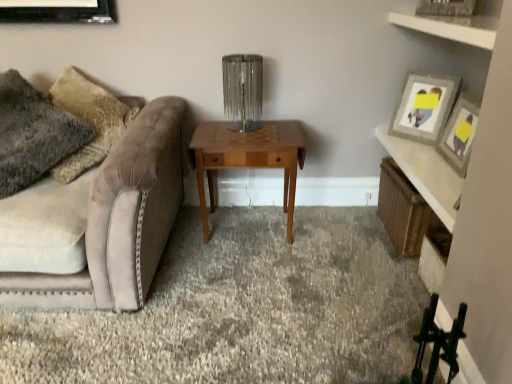
Question: Can you confirm if fuzzy fabric pillow at left is shorter than wooden picture frame at upper right?

Choices:
 (A) yes
 (B) no

Answer: (B)

Question: From a real-world perspective, does fuzzy fabric pillow at left stand above wooden picture frame at upper right?

Choices:
 (A) no
 (B) yes

Answer: (A)

Question: Is fuzzy fabric pillow at left wider than wooden picture frame at upper right?

Choices:
 (A) yes
 (B) no

Answer: (A)

Question: Can you confirm if fuzzy fabric pillow at left is positioned to the right of wooden picture frame at upper right?

Choices:
 (A) yes
 (B) no

Answer: (B)

Question: Is fuzzy fabric pillow at left at the left side of wooden picture frame at upper right?

Choices:
 (A) no
 (B) yes

Answer: (B)

Question: Looking at their shapes, would you say wooden picture frame at upper right is wider or thinner than woven wicker basket at right, marked as the first shelf in a bottom-to-top arrangement?

Choices:
 (A) thin
 (B) wide

Answer: (A)

Question: Is wooden picture frame at upper right taller or shorter than woven wicker basket at right, placed as the 2th shelf when sorted from top to bottom?

Choices:
 (A) tall
 (B) short

Answer: (A)

Question: Would you say wooden picture frame at upper right is to the left or to the right of woven wicker basket at right, the first shelf positioned from the back, in the picture?

Choices:
 (A) right
 (B) left

Answer: (A)

Question: Does point (445, 102) appear closer or farther from the camera than point (411, 226)?

Choices:
 (A) farther
 (B) closer

Answer: (A)

Question: Considering the relative positions of clear glass table lamp at center and white wood shelf at upper right, arranged as the 2th shelf when viewed from the back, in the image provided, is clear glass table lamp at center to the left or to the right of white wood shelf at upper right, arranged as the 2th shelf when viewed from the back,?

Choices:
 (A) right
 (B) left

Answer: (B)

Question: From a real-world perspective, is clear glass table lamp at center above or below white wood shelf at upper right, acting as the first shelf starting from the front?

Choices:
 (A) below
 (B) above

Answer: (A)

Question: Considering the positions of clear glass table lamp at center and white wood shelf at upper right, the second shelf in the bottom-to-top sequence, in the image, is clear glass table lamp at center bigger or smaller than white wood shelf at upper right, the second shelf in the bottom-to-top sequence,?

Choices:
 (A) big
 (B) small

Answer: (B)

Question: Is clear glass table lamp at center in front of or behind white wood shelf at upper right, arranged as the 2th shelf when viewed from the back, in the image?

Choices:
 (A) behind
 (B) front

Answer: (A)

Question: Looking at their shapes, would you say carpet at center is wider or thinner than velvet beige couch at left?

Choices:
 (A) wide
 (B) thin

Answer: (A)

Question: In terms of height, does carpet at center look taller or shorter compared to velvet beige couch at left?

Choices:
 (A) short
 (B) tall

Answer: (A)